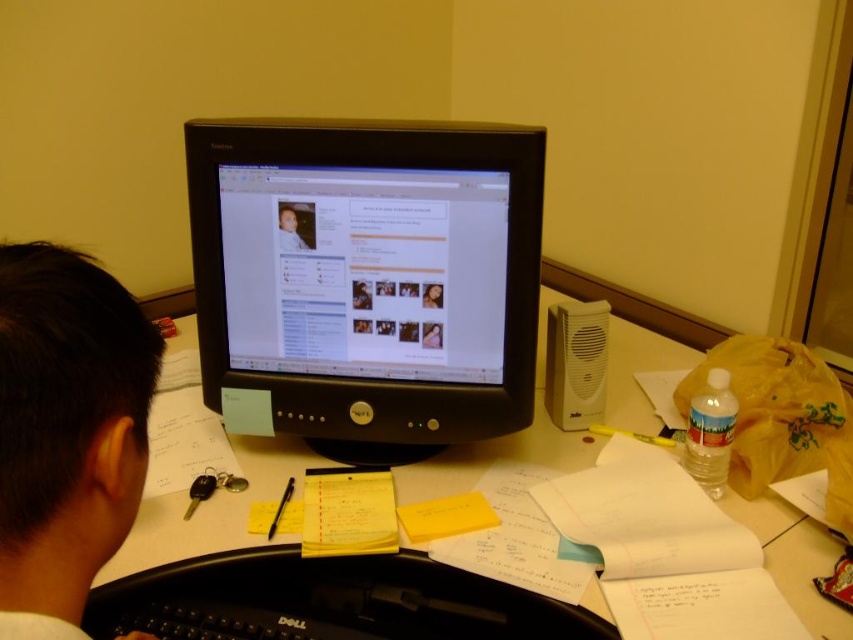
Does black plastic monitor at center have a lesser width compared to black hair at upper left?

No.

Which is behind, point (512, 330) or point (16, 474)?

The point (512, 330) is behind.

Who is more forward, (x=508, y=173) or (x=39, y=288)?

Positioned in front is point (x=39, y=288).

This screenshot has height=640, width=853. Identify the location of black plastic monitor at center. (368, 276).

Looking at this image, which of these two, black plastic monitor at center or yellow matte sticky notes at center, stands taller?

black plastic monitor at center

Does black plastic monitor at center have a greater height compared to yellow matte sticky notes at center?

Indeed, black plastic monitor at center has a greater height compared to yellow matte sticky notes at center.

Does point (497, 324) come closer to viewer compared to point (431, 518)?

That is False.

Find the location of a particular element. The width and height of the screenshot is (853, 640). black plastic monitor at center is located at coordinates (368, 276).

Who is more distant from viewer, (3, 266) or (463, 516)?

The point (463, 516) is more distant.

Can you confirm if black hair at upper left is positioned to the right of yellow matte sticky notes at center?

Incorrect, black hair at upper left is not on the right side of yellow matte sticky notes at center.

This screenshot has width=853, height=640. Identify the location of black hair at upper left. (67, 422).